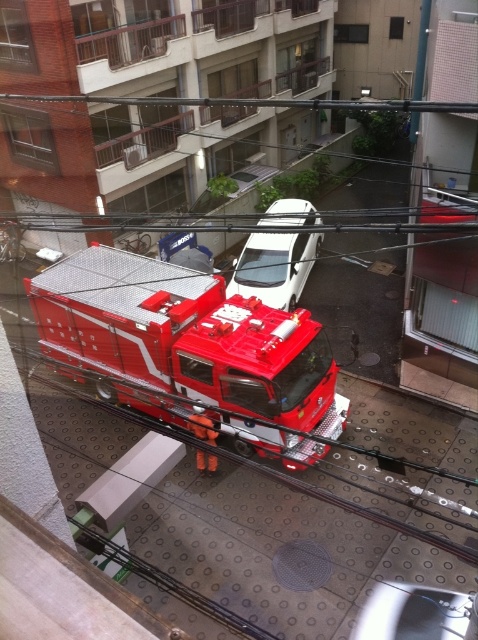
Consider the image. Can you confirm if metallic red fire truck at center is positioned to the left of metallic silver car at center?

Yes, metallic red fire truck at center is to the left of metallic silver car at center.

In the scene shown: Can you confirm if metallic red fire truck at center is positioned below metallic silver car at center?

No, metallic red fire truck at center is not below metallic silver car at center.

Between point (299, 416) and point (395, 620), which one is positioned behind?

The point (299, 416) is behind.

Find the location of a particular element. The image size is (478, 640). metallic red fire truck at center is located at coordinates (186, 337).

Is metallic red fire truck at center further to the viewer compared to white matte van at center?

No, metallic red fire truck at center is closer to the viewer.

Can you confirm if metallic red fire truck at center is smaller than white matte van at center?

Yes.

Find the location of `metallic red fire truck at center`. metallic red fire truck at center is located at coordinates (186, 337).

Is white matte van at center bigger than metallic silver car at center?

No.

Is white matte van at center wider than metallic silver car at center?

No, white matte van at center is not wider than metallic silver car at center.

Between point (296, 202) and point (426, 589), which one is positioned in front?

Point (426, 589)

Find the location of `white matte van at center`. white matte van at center is located at coordinates (274, 268).